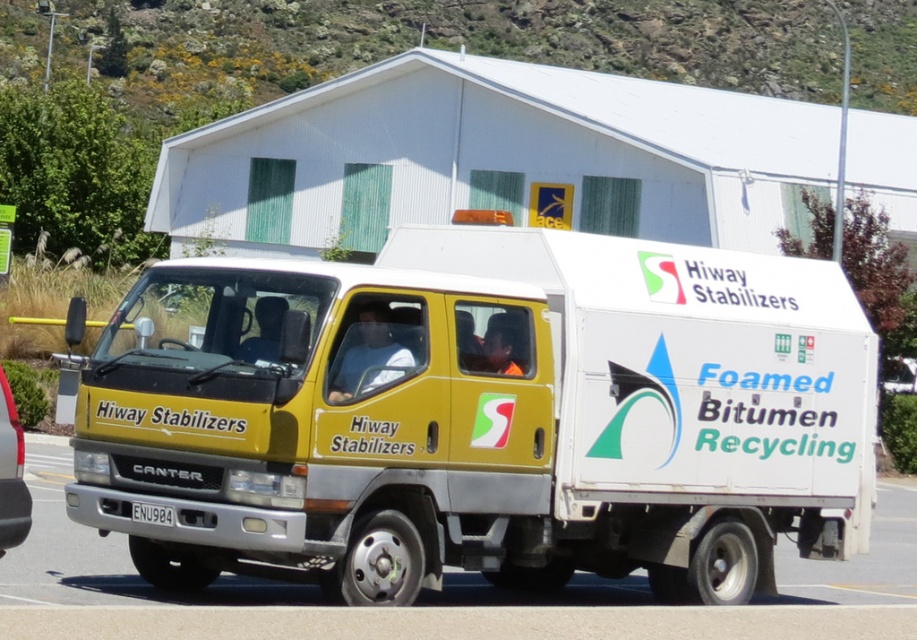
You are a photographer standing at a certain distance from the yellow matte truck at center. You want to capture a photo where the truck fills the frame without being too close to avoid distortion. Given that the truck is 10.45 meters away from the camera, what is the minimum focal length you should use if your camera sensor has a diagonal of 24mm and the truck itself is 3.5 meters in length?

To determine the minimum focal length required, we can use the formula for calculating focal length based on subject distance and sensor size. The formula is Focal Length mm x 0.03048 x Distance meters divided by Object Size meters. Plugging in the values, Focal Length x 0.03048 x 10.45 divided by 3.5 equals the sensor diagonal in mm. Rearranging the formula to solve for Focal Length gives us Focal Length equals Sensor Diagonal mm multiplied by Object Size meters divided by 0.03048 multiplied by Distance. 2

You are a delivery driver who needs to park your yellow matte truck at center so that its license plate is visible to the security camera above the entrance. The camera is positioned directly above the white plastic license plate at center. Where should you position your truck relative to the license plate?

Since the yellow matte truck at center is to the right of the white plastic license plate at center, you should position your truck to the right of the license plate so that the license plate remains visible to the camera positioned above it.